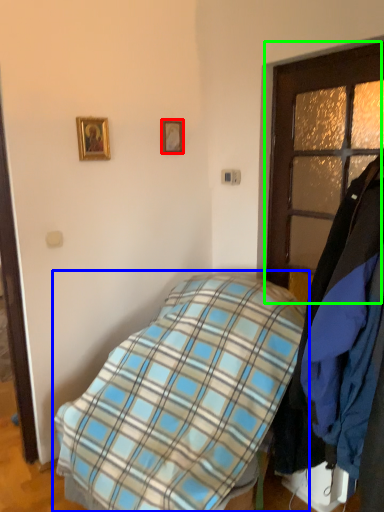
Question: Which object is positioned closest to picture frame (highlighted by a red box)? Select from bed (highlighted by a blue box) and door (highlighted by a green box).

Choices:
 (A) bed
 (B) door

Answer: (B)